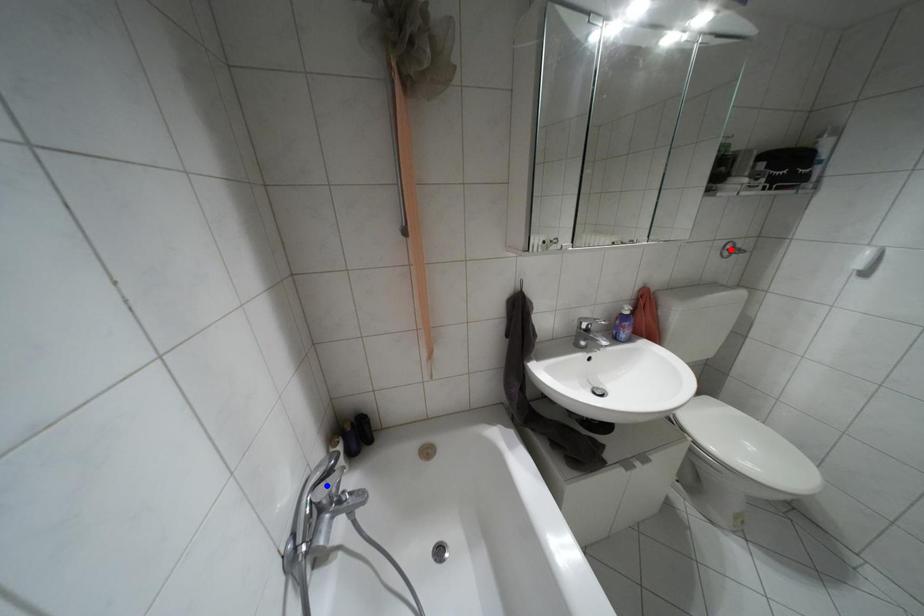
Question: Which of the two points in the image is closer to the camera?

Choices:
 (A) Blue point is closer.
 (B) Red point is closer.

Answer: (A)